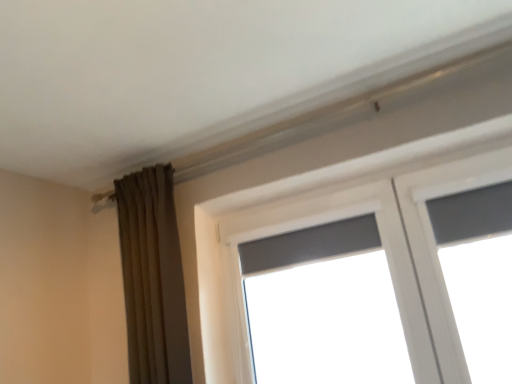
Locate an element on the screen. This screenshot has height=384, width=512. matte gray window at center is located at coordinates (323, 307).

The height and width of the screenshot is (384, 512). Describe the element at coordinates (323, 307) in the screenshot. I see `matte gray window at center` at that location.

Measure the distance between matte gray window at center and camera.

The distance of matte gray window at center from camera is 8.62 feet.

Image resolution: width=512 pixels, height=384 pixels. Describe the element at coordinates (153, 278) in the screenshot. I see `brown fabric curtain at left` at that location.

I want to click on brown fabric curtain at left, so click(153, 278).

Find the location of `matte gray window at center`. matte gray window at center is located at coordinates (323, 307).

Considering the positions of objects matte gray window at center and brown fabric curtain at left in the image provided, who is more to the left, matte gray window at center or brown fabric curtain at left?

brown fabric curtain at left is more to the left.

Is matte gray window at center in front of or behind brown fabric curtain at left in the image?

Clearly, matte gray window at center is in front of brown fabric curtain at left.

Which is closer, (278, 262) or (170, 266)?

The point (170, 266) is closer to the camera.

From the image's perspective, is matte gray window at center over brown fabric curtain at left?

Actually, matte gray window at center appears below brown fabric curtain at left in the image.

From a real-world perspective, is matte gray window at center physically located above or below brown fabric curtain at left?

matte gray window at center is below brown fabric curtain at left.

Which object is thinner, matte gray window at center or brown fabric curtain at left?

matte gray window at center is thinner.

In terms of height, does matte gray window at center look taller or shorter compared to brown fabric curtain at left?

In the image, matte gray window at center appears to be shorter than brown fabric curtain at left.

Which of these two, matte gray window at center or brown fabric curtain at left, is bigger?

brown fabric curtain at left.

Which is correct: matte gray window at center is inside brown fabric curtain at left, or outside of it?

matte gray window at center is not inside brown fabric curtain at left, it's outside.

Are matte gray window at center and brown fabric curtain at left far apart?

Yes, matte gray window at center is far from brown fabric curtain at left.

Is matte gray window at center turned away from brown fabric curtain at left?

matte gray window at center does not have its back to brown fabric curtain at left.

Based on the photo, how distant is matte gray window at center from brown fabric curtain at left?

matte gray window at center is 5.25 feet from brown fabric curtain at left.

I want to click on curtain above the matte gray window at center (from a real-world perspective), so click(153, 278).

Between brown fabric curtain at left and matte gray window at center, which one appears on the right side from the viewer's perspective?

matte gray window at center is more to the right.

Does brown fabric curtain at left come in front of matte gray window at center?

No.

Considering the positions of point (170, 356) and point (297, 253), is point (170, 356) closer or farther from the camera than point (297, 253)?

Clearly, point (170, 356) is closer to the camera than point (297, 253).

From the image's perspective, would you say brown fabric curtain at left is positioned over matte gray window at center?

Yes.

From a real-world perspective, which is physically below, brown fabric curtain at left or matte gray window at center?

matte gray window at center, from a real-world perspective.

Can you confirm if brown fabric curtain at left is wider than matte gray window at center?

Indeed, brown fabric curtain at left has a greater width compared to matte gray window at center.

Considering the relative sizes of brown fabric curtain at left and matte gray window at center in the image provided, is brown fabric curtain at left shorter than matte gray window at center?

No, brown fabric curtain at left is not shorter than matte gray window at center.

Considering the sizes of brown fabric curtain at left and matte gray window at center in the image, is brown fabric curtain at left bigger or smaller than matte gray window at center?

brown fabric curtain at left is bigger than matte gray window at center.

Would you say matte gray window at center is part of brown fabric curtain at left's contents?

Actually, matte gray window at center is outside brown fabric curtain at left.

In the scene shown: Is brown fabric curtain at left not near matte gray window at center?

Yes, brown fabric curtain at left and matte gray window at center are quite far apart.

Could you tell me if brown fabric curtain at left is turned towards matte gray window at center?

No, brown fabric curtain at left is not turned towards matte gray window at center.

Find the location of a particular element. This screenshot has width=512, height=384. window below the brown fabric curtain at left (from the image's perspective) is located at coordinates (323, 307).

Where is `curtain behind the matte gray window at center`? This screenshot has height=384, width=512. curtain behind the matte gray window at center is located at coordinates (153, 278).

The width and height of the screenshot is (512, 384). Identify the location of curtain located above the matte gray window at center (from the image's perspective). (153, 278).